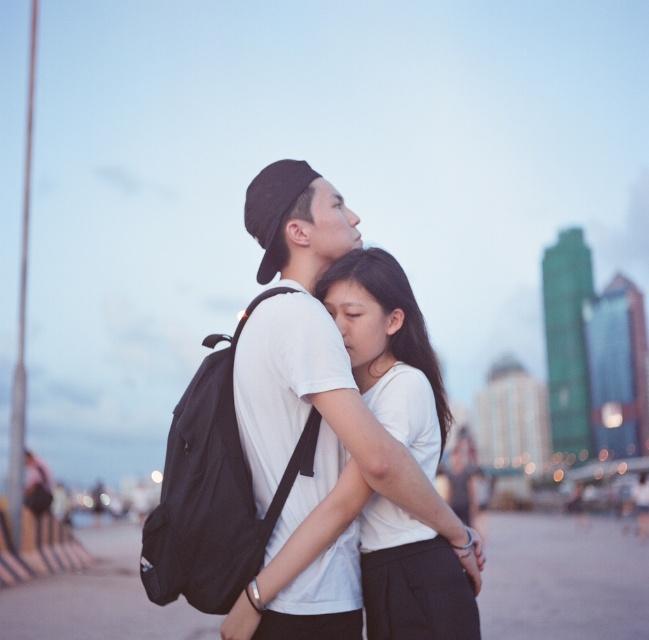
You are a fashion designer observing the scene. You need to create a new outfit that accommodates both the white matte shirt at center and the black matte backpack at center. Based on their sizes, which item should be prioritized in terms of space when designing the outfit?

The white matte shirt at center is wider than the black matte backpack at center, so when designing the outfit, the white matte shirt at center should be prioritized in terms of space to ensure proper fit and comfort.

You are a fashion designer observing this couple. You need to determine which item of clothing or accessory is taller between the white matte shirt at center and the black matte backpack at center. Which one is taller?

The white matte shirt at center is taller than the black matte backpack at center according to the description.